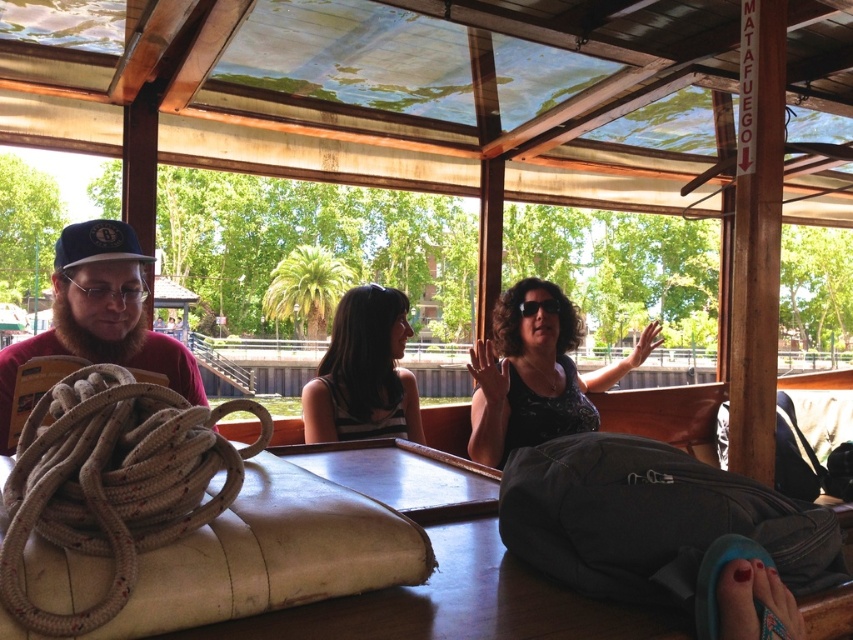
Can you confirm if black textured tank top at center is positioned to the left of blue fabric baseball cap at left?

No, black textured tank top at center is not to the left of blue fabric baseball cap at left.

Between point (418, 428) and point (97, 248), which one is positioned behind?

Point (418, 428)

Between point (339, 340) and point (74, 230), which one is positioned behind?

Point (339, 340)

In order to click on black textured tank top at center in this screenshot , I will do `click(364, 372)`.

Does matte red cap at left appear under black textured tank top at center?

Actually, matte red cap at left is above black textured tank top at center.

Find the location of `matte red cap at left`. matte red cap at left is located at coordinates (99, 316).

The image size is (853, 640). Find the location of `matte red cap at left`. matte red cap at left is located at coordinates (99, 316).

Who is positioned more to the left, matte black shirt at center or matte red cap at left?

matte red cap at left

Is matte black shirt at center shorter than matte red cap at left?

No, matte black shirt at center is not shorter than matte red cap at left.

Who is more distant from viewer, (560, 365) or (76, 275)?

Positioned behind is point (560, 365).

At what (x,y) coordinates should I click in order to perform the action: click on matte black shirt at center. Please return your answer as a coordinate pair (x, y). This screenshot has width=853, height=640. Looking at the image, I should click on (537, 372).